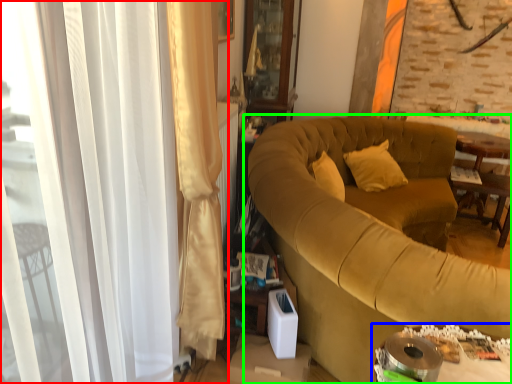
Question: Considering the real-world distances, which object is closest to curtain (highlighted by a red box)? table (highlighted by a blue box) or studio couch (highlighted by a green box).

Choices:
 (A) table
 (B) studio couch

Answer: (A)